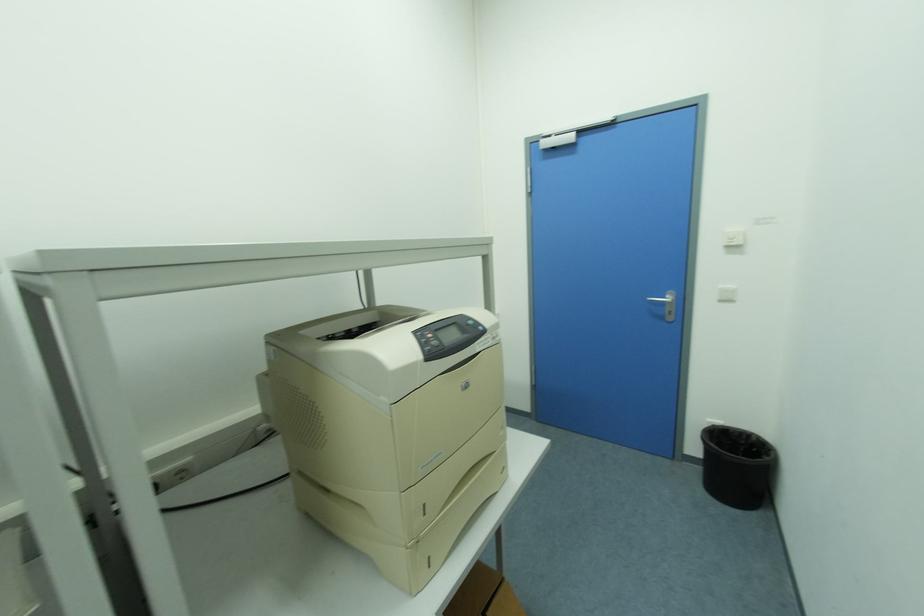
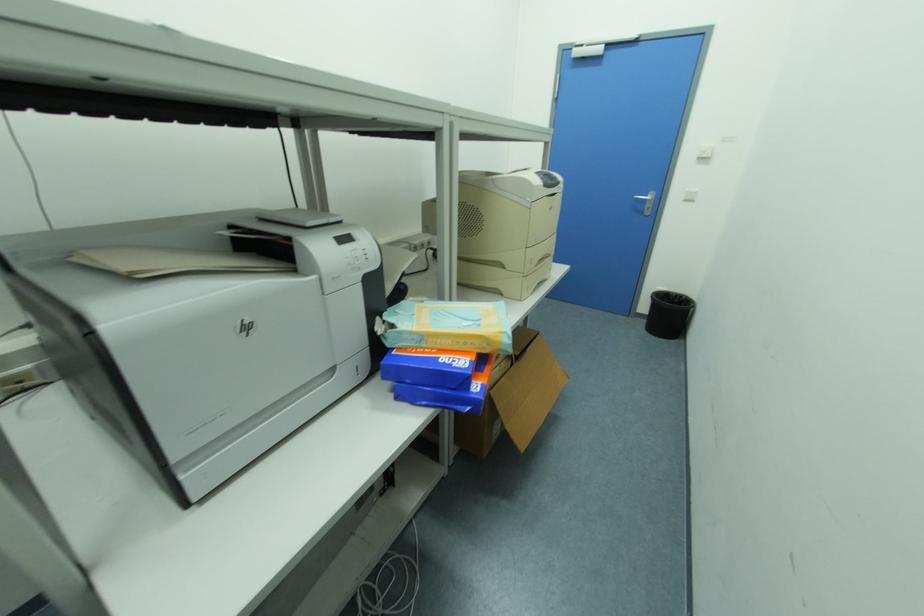
The images are taken continuously from a first-person perspective. In which direction are you moving?

The cameraman walked toward left, backward.